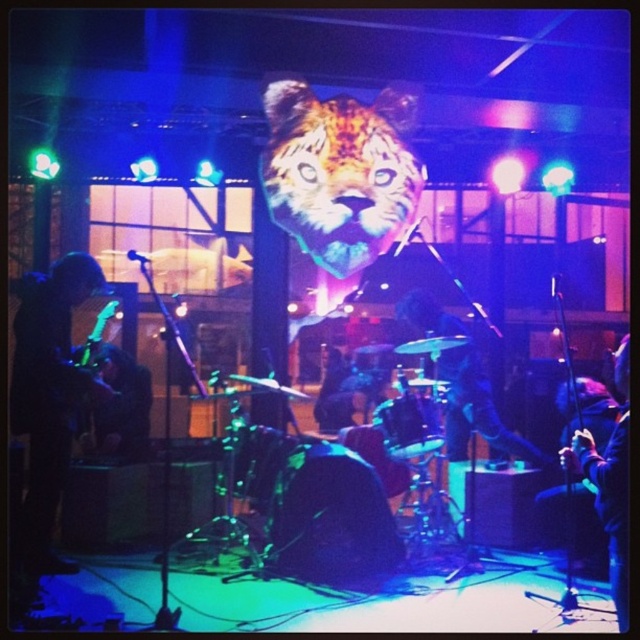
You are a photographer trying to capture a clear shot of the shiny black guitar at lower right without the shiny orange tiger head at center in the background. Is the tiger head positioned in a way that might block your view of the guitar?

The shiny orange tiger head at center is positioned on the left side of the shiny black guitar at lower right, so it might block the view of the guitar if you are shooting from the left side. To avoid the tiger head, you should position yourself to the right side of the guitar where the tiger head is not obstructing the view.

You are a photographer at the live music performance. You want to take a photo of the stage. Where should you position your camera to ensure the shiny orange tiger head at center is in the center of your photo?

The shiny orange tiger head at center is already positioned at the center of the stage at point [339,172], so you should position your camera directly facing that point to ensure it is centered in your photo.